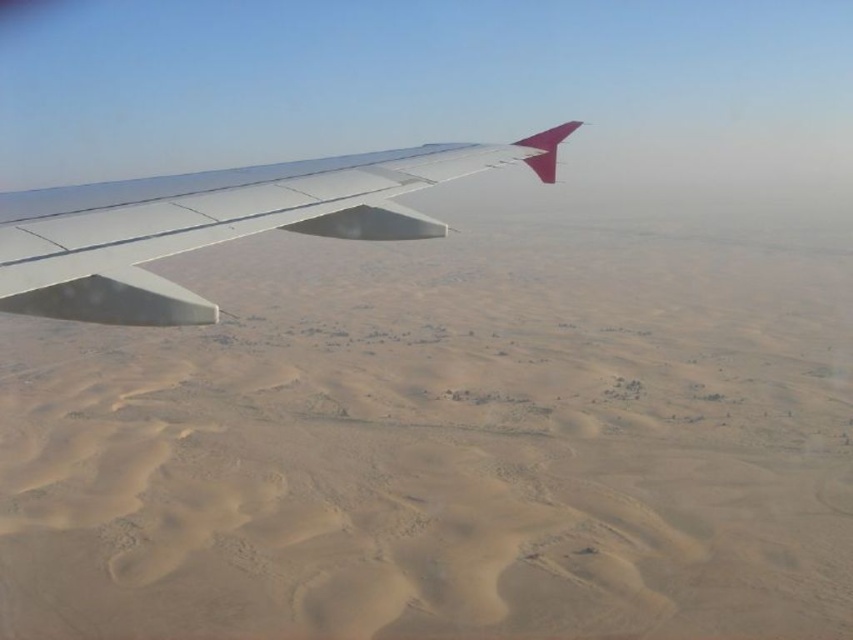
Who is shorter, desert sand at left or metallic wing at upper left?

With less height is metallic wing at upper left.

Describe the element at coordinates (445, 442) in the screenshot. Image resolution: width=853 pixels, height=640 pixels. I see `desert sand at left` at that location.

Does point (785, 483) come closer to viewer compared to point (305, 173)?

No, it is not.

Find the location of `desert sand at left`. desert sand at left is located at coordinates (445, 442).